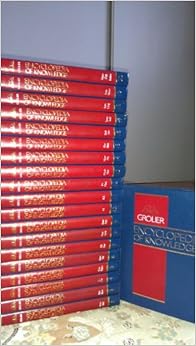
Locate an element on the screen. The image size is (196, 346). counter top is located at coordinates (110, 332).